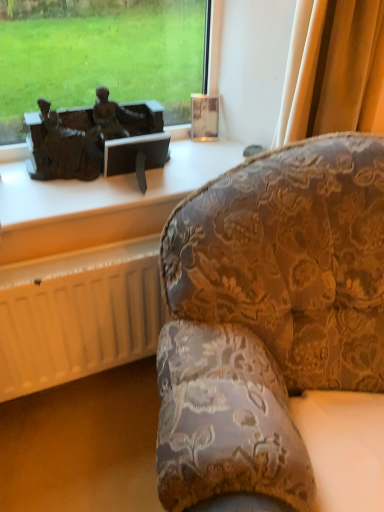
Question: Is bronze statue at left looking in the opposite direction of white matte radiator at lower left?

Choices:
 (A) yes
 (B) no

Answer: (B)

Question: Does bronze statue at left have a larger size compared to white matte radiator at lower left?

Choices:
 (A) no
 (B) yes

Answer: (A)

Question: Is bronze statue at left aimed at white matte radiator at lower left?

Choices:
 (A) no
 (B) yes

Answer: (A)

Question: Does bronze statue at left have a lesser height compared to white matte radiator at lower left?

Choices:
 (A) no
 (B) yes

Answer: (B)

Question: Is bronze statue at left closer to the viewer compared to white matte radiator at lower left?

Choices:
 (A) yes
 (B) no

Answer: (B)

Question: Does point (165, 211) appear closer or farther from the camera than point (294, 369)?

Choices:
 (A) closer
 (B) farther

Answer: (B)

Question: From the image's perspective, relative to velvet floral-patterned couch at right, is matte bronze sculpture at upper left above or below?

Choices:
 (A) below
 (B) above

Answer: (B)

Question: From their relative heights in the image, would you say matte bronze sculpture at upper left is taller or shorter than velvet floral-patterned couch at right?

Choices:
 (A) short
 (B) tall

Answer: (A)

Question: Is matte bronze sculpture at upper left situated inside velvet floral-patterned couch at right or outside?

Choices:
 (A) inside
 (B) outside

Answer: (B)

Question: Is point (21, 372) closer or farther from the camera than point (268, 180)?

Choices:
 (A) closer
 (B) farther

Answer: (B)

Question: Based on their positions, is white matte radiator at lower left located to the left or right of velvet floral-patterned couch at right?

Choices:
 (A) left
 (B) right

Answer: (A)

Question: Would you say white matte radiator at lower left is inside or outside velvet floral-patterned couch at right?

Choices:
 (A) inside
 (B) outside

Answer: (B)

Question: Considering the positions of white matte radiator at lower left and velvet floral-patterned couch at right in the image, is white matte radiator at lower left wider or thinner than velvet floral-patterned couch at right?

Choices:
 (A) wide
 (B) thin

Answer: (B)

Question: From a real-world perspective, relative to matte bronze sculpture at upper left, is white matte radiator at lower left vertically above or below?

Choices:
 (A) below
 (B) above

Answer: (A)

Question: Considering the relative positions of white matte radiator at lower left and matte bronze sculpture at upper left in the image provided, is white matte radiator at lower left to the left or to the right of matte bronze sculpture at upper left?

Choices:
 (A) left
 (B) right

Answer: (A)